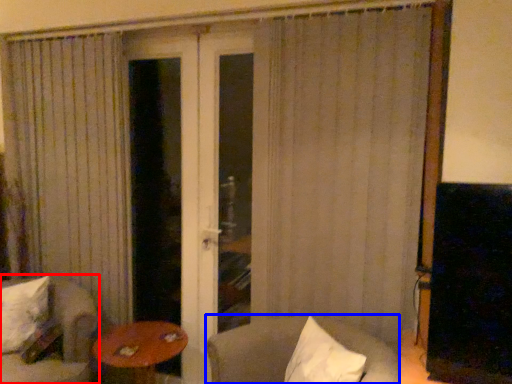
Question: Which object is closer to the camera taking this photo, chair (highlighted by a red box) or chair (highlighted by a blue box)?

Choices:
 (A) chair
 (B) chair

Answer: (B)